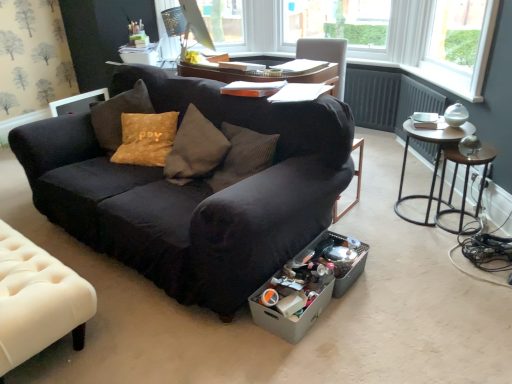
Question: Is metallic brown side table at right to the left of matte black monitor at upper center from the viewer's perspective?

Choices:
 (A) yes
 (B) no

Answer: (B)

Question: Is metallic brown side table at right positioned in front of matte black monitor at upper center?

Choices:
 (A) yes
 (B) no

Answer: (A)

Question: From the image's perspective, does metallic brown side table at right appear higher than matte black monitor at upper center?

Choices:
 (A) no
 (B) yes

Answer: (A)

Question: Does metallic brown side table at right have a smaller size compared to matte black monitor at upper center?

Choices:
 (A) no
 (B) yes

Answer: (B)

Question: From the image's perspective, is metallic brown side table at right below matte black monitor at upper center?

Choices:
 (A) yes
 (B) no

Answer: (A)

Question: Is matte black monitor at upper center wider or thinner than metallic brown side table at right?

Choices:
 (A) thin
 (B) wide

Answer: (B)

Question: Which is correct: matte black monitor at upper center is inside metallic brown side table at right, or outside of it?

Choices:
 (A) inside
 (B) outside

Answer: (B)

Question: Is matte black monitor at upper center bigger or smaller than metallic brown side table at right?

Choices:
 (A) big
 (B) small

Answer: (A)

Question: Relative to metallic brown side table at right, is matte black monitor at upper center in front or behind?

Choices:
 (A) behind
 (B) front

Answer: (A)

Question: In terms of height, does gray cardboard box at lower center look taller or shorter compared to white tufted leather at lower left?

Choices:
 (A) short
 (B) tall

Answer: (A)

Question: Considering the positions of point (322, 292) and point (18, 319), is point (322, 292) closer or farther from the camera than point (18, 319)?

Choices:
 (A) closer
 (B) farther

Answer: (B)

Question: Considering the positions of gray cardboard box at lower center and white tufted leather at lower left in the image, is gray cardboard box at lower center wider or thinner than white tufted leather at lower left?

Choices:
 (A) thin
 (B) wide

Answer: (A)

Question: From the image's perspective, is gray cardboard box at lower center positioned above or below white tufted leather at lower left?

Choices:
 (A) below
 (B) above

Answer: (A)

Question: Is metallic round table at right spatially inside white tufted leather at lower left, or outside of it?

Choices:
 (A) outside
 (B) inside

Answer: (A)

Question: In terms of width, does metallic round table at right look wider or thinner when compared to white tufted leather at lower left?

Choices:
 (A) thin
 (B) wide

Answer: (A)